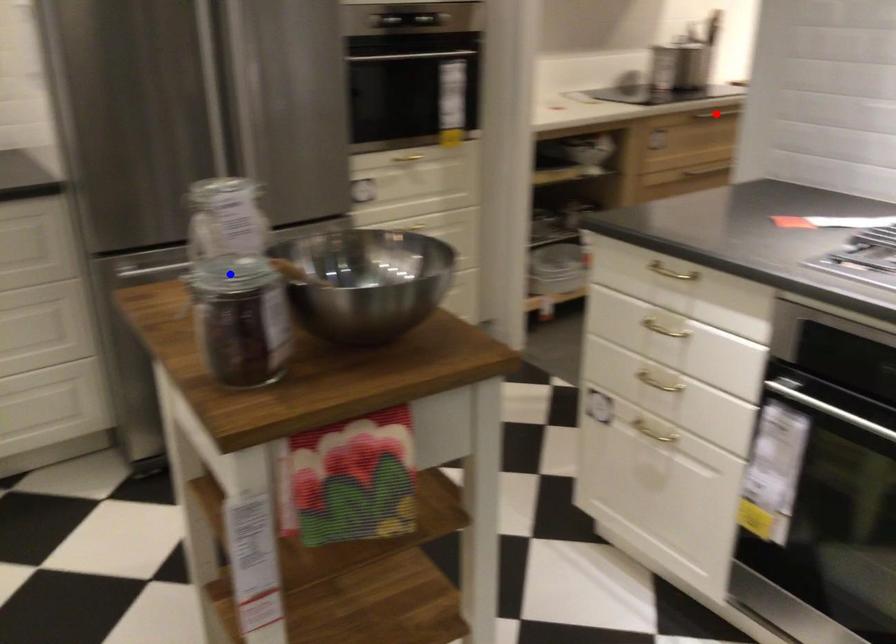
Question: In the image, two points are highlighted. Which point is nearer to the camera? Reply with the corresponding letter.

Choices:
 (A) blue point
 (B) red point

Answer: (A)